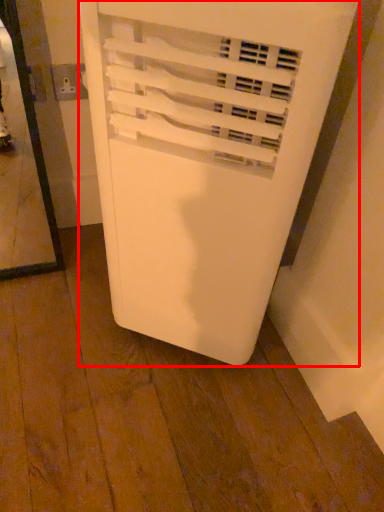
Question: From the image's perspective, what is the correct spatial positioning of home appliance (annotated by the red box) in reference to electric outlet?

Choices:
 (A) below
 (B) above

Answer: (A)